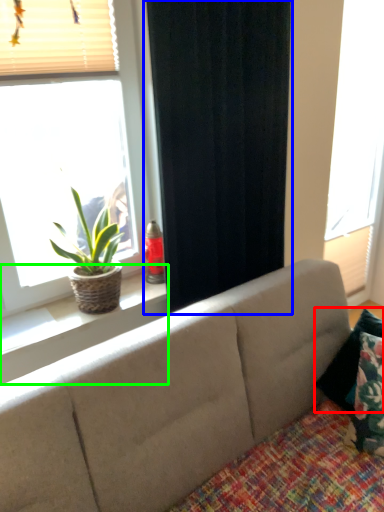
Question: Considering the real-world distances, which object is farthest from pillow (highlighted by a red box)? curtain (highlighted by a blue box) or window sill (highlighted by a green box)?

Choices:
 (A) curtain
 (B) window sill

Answer: (B)